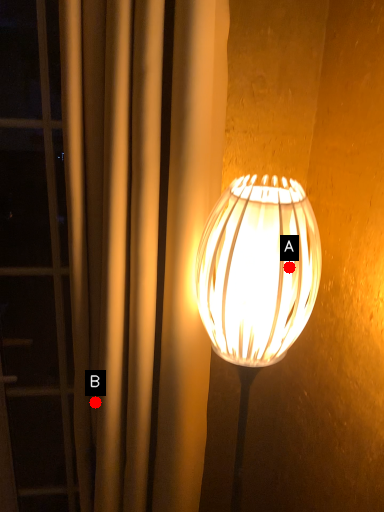
Question: Two points are circled on the image, labeled by A and B beside each circle. Among these points, which one is nearest to the camera?

Choices:
 (A) A is closer
 (B) B is closer

Answer: (A)